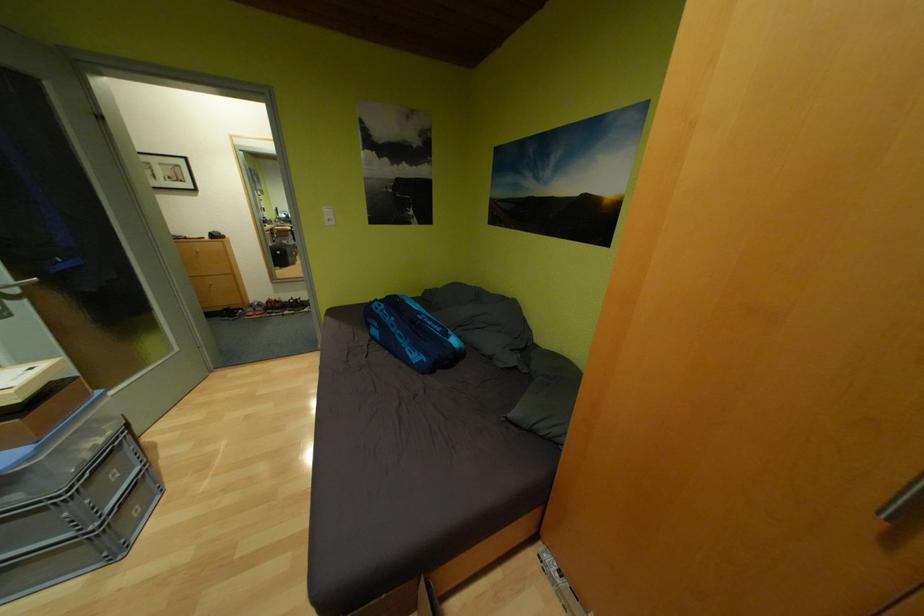
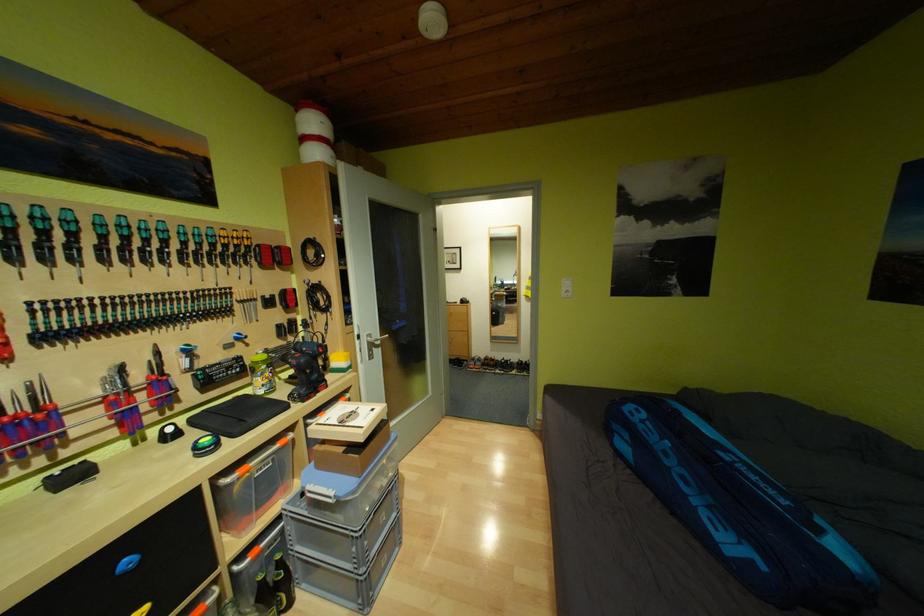
In the second image, find the point that corresponds to pixel 27 402 in the first image.

(371, 440)